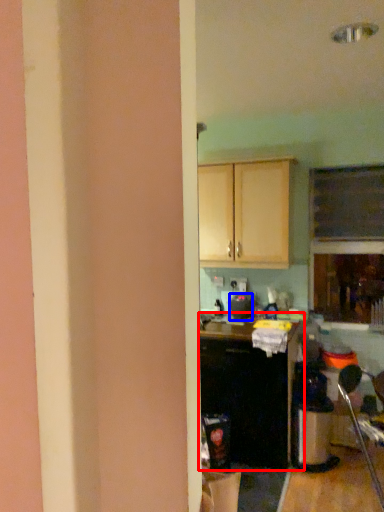
Question: Which point is closer to the camera, cabinetry (highlighted by a red box) or appliance (highlighted by a blue box)?

Choices:
 (A) cabinetry
 (B) appliance

Answer: (A)